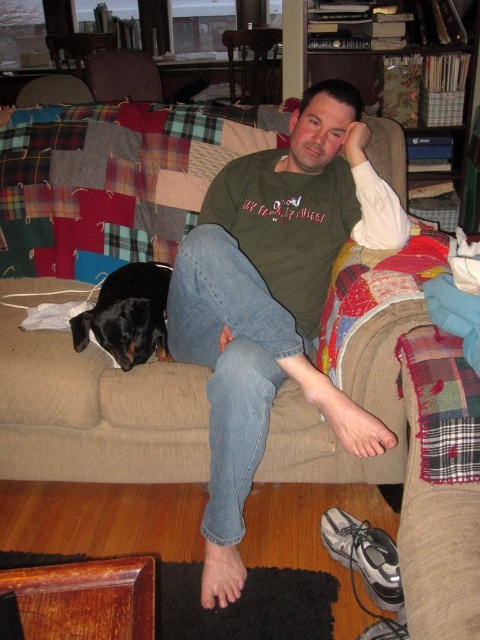
Measure the distance from green cotton shirt at center to black smooth dog at lower left.

The distance of green cotton shirt at center from black smooth dog at lower left is 10.62 inches.

Is point (227, 588) positioned behind point (149, 305)?

No, it is in front of (149, 305).

Where is `green cotton shirt at center`? The image size is (480, 640). green cotton shirt at center is located at coordinates (274, 300).

Where is `green cotton shirt at center`? The image size is (480, 640). green cotton shirt at center is located at coordinates (274, 300).

Which is below, beige fabric couch at center or black smooth dog at lower left?

beige fabric couch at center is lower down.

Between beige fabric couch at center and black smooth dog at lower left, which one is positioned higher?

black smooth dog at lower left is higher up.

The image size is (480, 640). What do you see at coordinates (92, 404) in the screenshot?
I see `beige fabric couch at center` at bounding box center [92, 404].

Locate an element on the screen. beige fabric couch at center is located at coordinates (92, 404).

Is green cotton shirt at center below beige fabric couch at center?

Actually, green cotton shirt at center is above beige fabric couch at center.

In the scene shown: Does green cotton shirt at center appear over beige fabric couch at center?

Indeed, green cotton shirt at center is positioned over beige fabric couch at center.

In order to click on green cotton shirt at center in this screenshot , I will do [x=274, y=300].